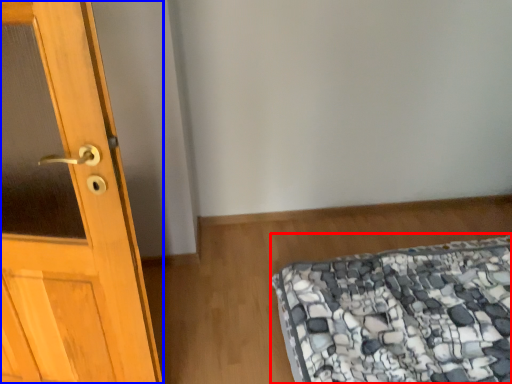
Question: Which point is further to the camera, mattress (highlighted by a red box) or door (highlighted by a blue box)?

Choices:
 (A) mattress
 (B) door

Answer: (A)